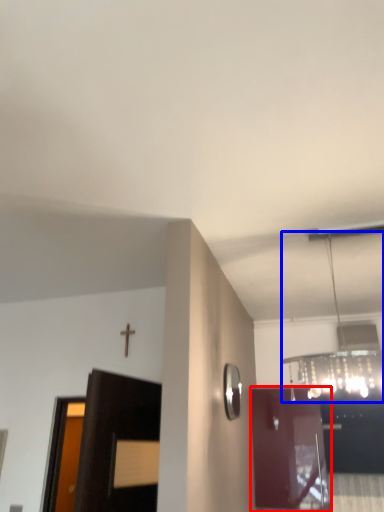
Question: Which object appears farthest to the camera in this image, door (highlighted by a red box) or light fixture (highlighted by a blue box)?

Choices:
 (A) door
 (B) light fixture

Answer: (A)